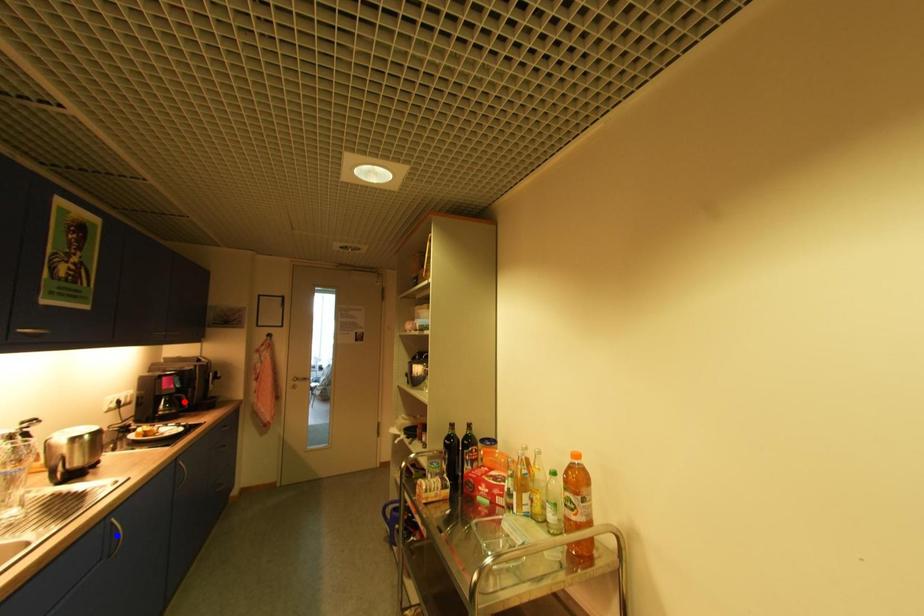
Question: Two points are marked on the image. Which point is closer to the camera?

Choices:
 (A) Blue point is closer.
 (B) Red point is closer.

Answer: (A)